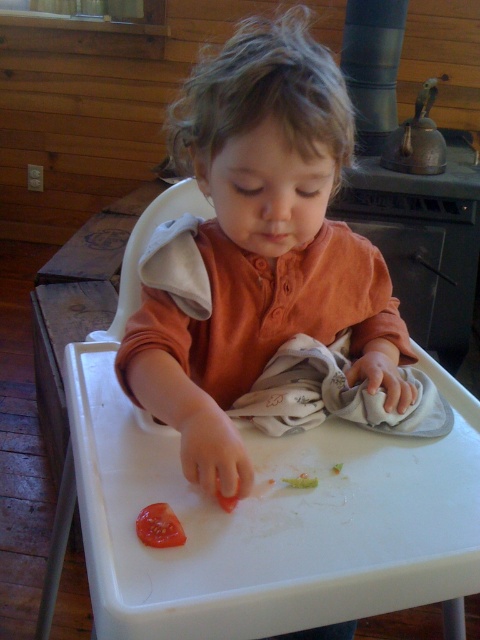
You are a parent trying to ensure your child doesn not spill food during mealtime. The child is wearing the matte orange shirt at center and has a juicy red tomato at lower center on their high chair tray. Which item is positioned higher relative to the other?

The matte orange shirt at center is located above the juicy red tomato at lower center, so the shirt is higher than the tomato.